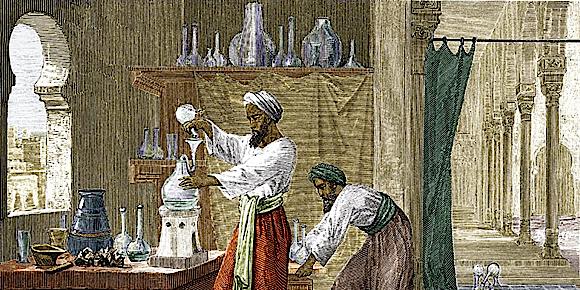
The width and height of the screenshot is (580, 290). Find the location of `shelves`. shelves is located at coordinates (148, 162), (160, 74).